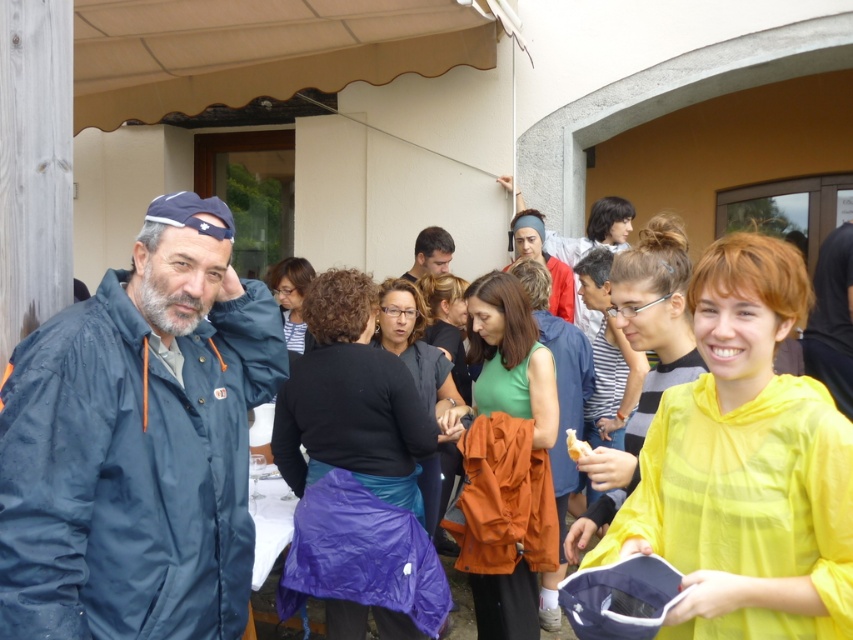
Question: Which point is farther to the camera?

Choices:
 (A) (450, 252)
 (B) (556, 292)

Answer: (A)

Question: Is matte blue jacket at left positioned at the back of matte blue jacket at center?

Choices:
 (A) no
 (B) yes

Answer: (A)

Question: Estimate the real-world distances between objects in this image. Which object is closer to the matte black hair at center?

Choices:
 (A) matte blue jacket at center
 (B) matte blue jacket at left

Answer: (A)

Question: In this image, where is matte blue jacket at center located relative to matte black hair at center?

Choices:
 (A) below
 (B) above

Answer: (A)

Question: Which object appears farthest from the camera in this image?

Choices:
 (A) matte blue jacket at center
 (B) matte black hair at center
 (C) matte blue jacket at left

Answer: (B)

Question: Is matte blue jacket at center positioned in front of matte black hair at center?

Choices:
 (A) yes
 (B) no

Answer: (A)